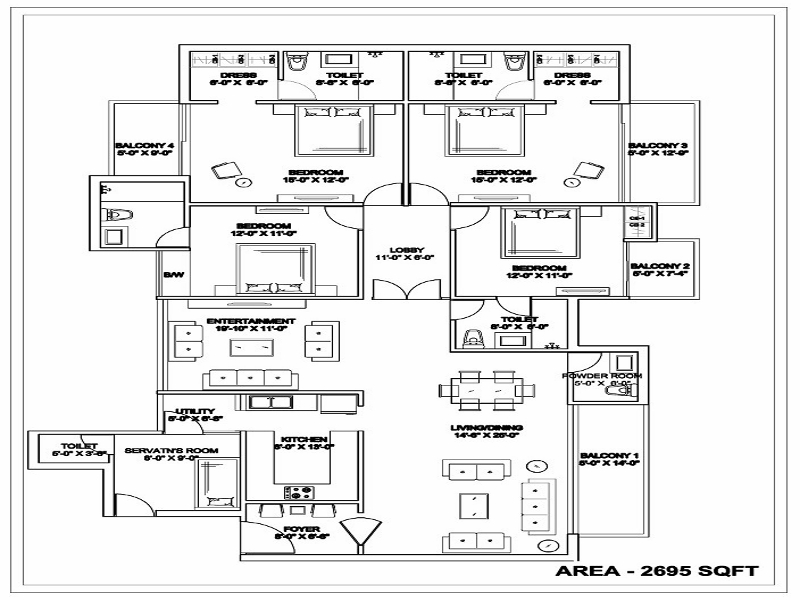
This screenshot has height=600, width=800. What are the coordinates of `lobby` in the screenshot? It's located at (408, 249).